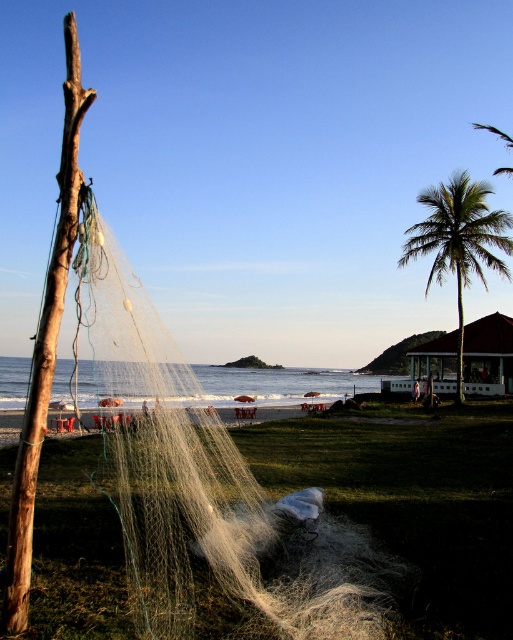
Question: Is white mesh fishing net at center thinner than brown wooden hut at center-right?

Choices:
 (A) yes
 (B) no

Answer: (B)

Question: Estimate the real-world distances between objects in this image. Which object is closer to the white sand beach at center?

Choices:
 (A) brown wooden hut at center-right
 (B) green leafy palm tree at right
 (C) white mesh fishing net at center

Answer: (C)

Question: Based on their relative distances, which object is nearer to the green leafy palm tree at right?

Choices:
 (A) brown wooden hut at center-right
 (B) white mesh fishing net at center

Answer: (A)

Question: Which object appears closest to the camera in this image?

Choices:
 (A) white mesh fishing net at center
 (B) white sand beach at center

Answer: (A)

Question: Is white mesh fishing net at center in front of white sand beach at center?

Choices:
 (A) no
 (B) yes

Answer: (B)

Question: Is green leafy palm tree at right further to camera compared to brown wooden hut at center-right?

Choices:
 (A) no
 (B) yes

Answer: (A)